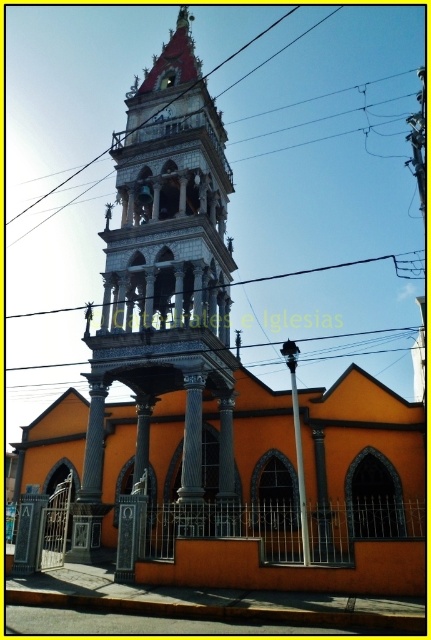
You are an architect analyzing the church building. You notice the white marble tower at center and the metallic wire at upper center. Which structure has a greater height?

The metallic wire at upper center is taller than the white marble tower at center.

From the picture: You are standing in front of the church and notice the polished stone pillar at center and the metallic wire at upper center. Which object is closer to you?

The polished stone pillar at center is closer to you because it is in front of the metallic wire at upper center.